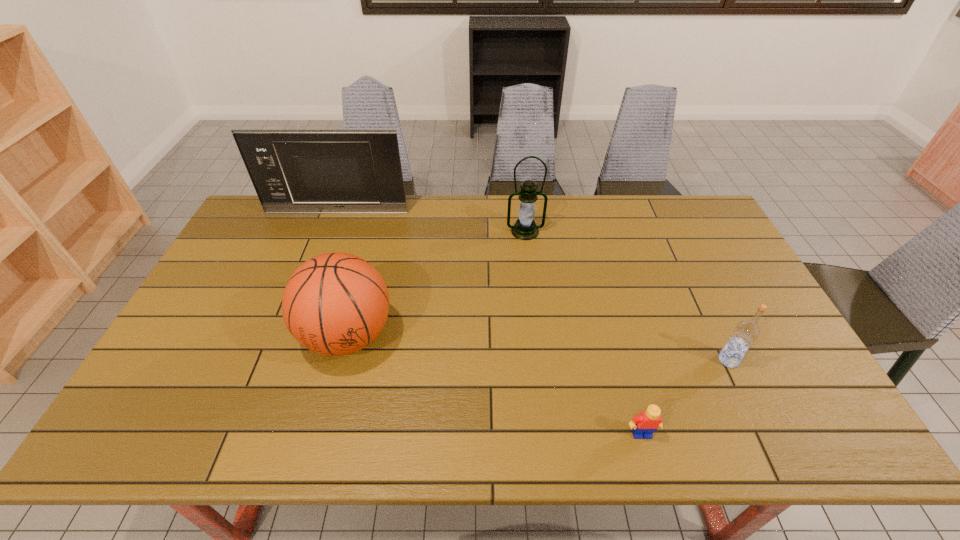
Locate an element on the screen. The image size is (960, 540). free space at the left edge of the desktop is located at coordinates (267, 244).

Identify the location of vacant space at the right edge of the desktop. 786,407.

Find the location of a particular element. free space at the near right corner of the desktop is located at coordinates (776, 419).

Find the location of `empty location between the basketball and the third object from left to right`. empty location between the basketball and the third object from left to right is located at coordinates (437, 284).

Where is `free space that is in between the Lego and the lantern`? free space that is in between the Lego and the lantern is located at coordinates (584, 333).

Identify the location of unoccupied position between the fourth object from left to right and the vodka. The image size is (960, 540). (684, 397).

Find the location of a particular element. free spot between the basketball and the lantern is located at coordinates (437, 284).

At what (x,y) coordinates should I click in order to perform the action: click on vacant area that lies between the fourth object from left to right and the basketball. Please return your answer as a coordinate pair (x, y). Image resolution: width=960 pixels, height=540 pixels. Looking at the image, I should click on (494, 385).

Image resolution: width=960 pixels, height=540 pixels. In order to click on free space between the lantern and the basketball in this screenshot , I will do pos(437,284).

Where is `free area in between the fourth object from left to right and the rightmost object`? This screenshot has height=540, width=960. free area in between the fourth object from left to right and the rightmost object is located at coordinates (684, 397).